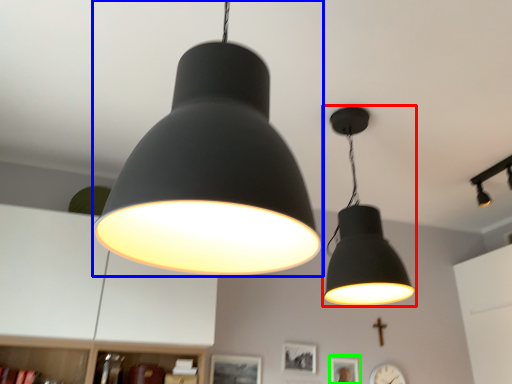
Question: Estimate the real-world distances between objects in this image. Which object is farther from lamp (highlighted by a red box), lamp (highlighted by a blue box) or picture frame (highlighted by a green box)?

Choices:
 (A) lamp
 (B) picture frame

Answer: (B)